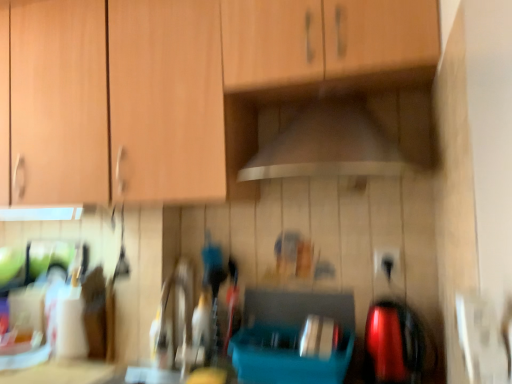
What do you see at coordinates (387, 263) in the screenshot? I see `black plastic electric outlet at lower right` at bounding box center [387, 263].

What do you see at coordinates (180, 87) in the screenshot? I see `wooden cabinet at upper center` at bounding box center [180, 87].

In order to click on white glossy countertop at lower left in this screenshot , I will do `click(62, 372)`.

Where is `electric outlet on the right side of white glossy countertop at lower left`? electric outlet on the right side of white glossy countertop at lower left is located at coordinates (387, 263).

How different are the orientations of white glossy countertop at lower left and black plastic electric outlet at lower right in degrees?

The facing directions of white glossy countertop at lower left and black plastic electric outlet at lower right are 1.6 degrees apart.

Considering the relative sizes of white glossy countertop at lower left and black plastic electric outlet at lower right in the image provided, is white glossy countertop at lower left bigger than black plastic electric outlet at lower right?

Yes, white glossy countertop at lower left is bigger than black plastic electric outlet at lower right.

Who is more distant, white glossy countertop at lower left or black plastic electric outlet at lower right?

black plastic electric outlet at lower right is behind.

Which is more to the right, black plastic electric outlet at lower right or wooden cabinet at upper center?

Positioned to the right is black plastic electric outlet at lower right.

Where is `cabinetry on the left of black plastic electric outlet at lower right`? The image size is (512, 384). cabinetry on the left of black plastic electric outlet at lower right is located at coordinates (180, 87).

From the image's perspective, is black plastic electric outlet at lower right on wooden cabinet at upper center?

No, from the image's perspective, black plastic electric outlet at lower right is not above wooden cabinet at upper center.

From their relative heights in the image, would you say wooden cabinet at upper center is taller or shorter than black plastic electric outlet at lower right?

Considering their sizes, wooden cabinet at upper center has more height than black plastic electric outlet at lower right.

Looking at their sizes, would you say wooden cabinet at upper center is wider or thinner than black plastic electric outlet at lower right?

Considering their sizes, wooden cabinet at upper center looks broader than black plastic electric outlet at lower right.

Is wooden cabinet at upper center facing away from black plastic electric outlet at lower right?

No, wooden cabinet at upper center's orientation is not away from black plastic electric outlet at lower right.

Is wooden cabinet at upper center positioned in front of black plastic electric outlet at lower right?

Yes, the depth of wooden cabinet at upper center is less than that of black plastic electric outlet at lower right.

Which is more to the left, white glossy countertop at lower left or wooden cabinet at upper center?

Positioned to the left is white glossy countertop at lower left.

Is white glossy countertop at lower left positioned with its back to wooden cabinet at upper center?

No, white glossy countertop at lower left's orientation is not away from wooden cabinet at upper center.

Considering the positions of point (60, 379) and point (292, 54), is point (60, 379) closer or farther from the camera than point (292, 54)?

Point (60, 379) is positioned farther from the camera compared to point (292, 54).

Which of these two, white glossy countertop at lower left or wooden cabinet at upper center, is wider?

Wider between the two is wooden cabinet at upper center.

Which of these two, black plastic electric outlet at lower right or white glossy countertop at lower left, is wider?

Wider between the two is white glossy countertop at lower left.

Does black plastic electric outlet at lower right contain white glossy countertop at lower left?

No, white glossy countertop at lower left is not surrounded by black plastic electric outlet at lower right.

Does black plastic electric outlet at lower right have a greater height compared to white glossy countertop at lower left?

Correct, black plastic electric outlet at lower right is much taller as white glossy countertop at lower left.

From the image's perspective, is black plastic electric outlet at lower right located beneath white glossy countertop at lower left?

No, from the image's perspective, black plastic electric outlet at lower right is not below white glossy countertop at lower left.

Could you tell me if wooden cabinet at upper center is facing white glossy countertop at lower left?

No, wooden cabinet at upper center is not turned towards white glossy countertop at lower left.

Between wooden cabinet at upper center and white glossy countertop at lower left, which one is positioned in front?

wooden cabinet at upper center.

Considering the positions of objects wooden cabinet at upper center and white glossy countertop at lower left in the image provided, who is more to the right, wooden cabinet at upper center or white glossy countertop at lower left?

Positioned to the right is wooden cabinet at upper center.

Identify the location of electric outlet lying behind the white glossy countertop at lower left. The height and width of the screenshot is (384, 512). (387, 263).

Where is `cabinetry on the left of black plastic electric outlet at lower right`? The height and width of the screenshot is (384, 512). cabinetry on the left of black plastic electric outlet at lower right is located at coordinates (180, 87).

Considering their positions, is wooden cabinet at upper center positioned further to white glossy countertop at lower left than black plastic electric outlet at lower right?

Based on the image, black plastic electric outlet at lower right appears to be further to white glossy countertop at lower left.

From the image, which object appears to be nearer to black plastic electric outlet at lower right, wooden cabinet at upper center or white glossy countertop at lower left?

→ Among the two, wooden cabinet at upper center is located nearer to black plastic electric outlet at lower right.

Looking at the image, which one is located further to wooden cabinet at upper center, black plastic electric outlet at lower right or white glossy countertop at lower left?

The object further to wooden cabinet at upper center is white glossy countertop at lower left.

Looking at the image, which one is located further to black plastic electric outlet at lower right, white glossy countertop at lower left or wooden cabinet at upper center?

white glossy countertop at lower left lies further to black plastic electric outlet at lower right than the other object.

From the image, which object appears to be nearer to white glossy countertop at lower left, black plastic electric outlet at lower right or wooden cabinet at upper center?

wooden cabinet at upper center is positioned closer to the anchor white glossy countertop at lower left.

From the image, which object appears to be nearer to wooden cabinet at upper center, white glossy countertop at lower left or black plastic electric outlet at lower right?

The object closer to wooden cabinet at upper center is black plastic electric outlet at lower right.

Locate an element on the screen. cabinetry between white glossy countertop at lower left and black plastic electric outlet at lower right in the horizontal direction is located at coordinates (180, 87).